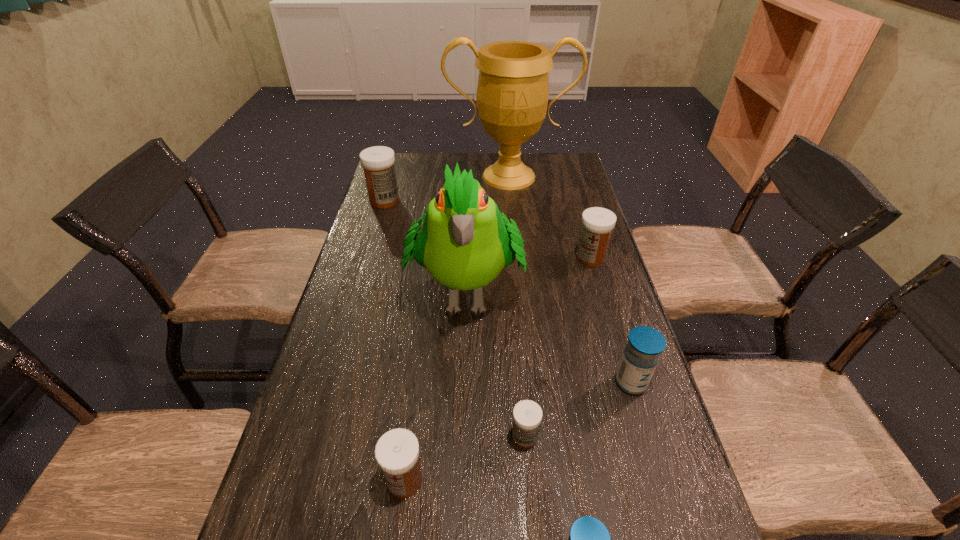
Where is `free space in the image that satisfies the following two spatial constraints: 1. on the back side of the right blue medicine; 2. on the right side of the second medicine from left to right`? free space in the image that satisfies the following two spatial constraints: 1. on the back side of the right blue medicine; 2. on the right side of the second medicine from left to right is located at coordinates (417, 383).